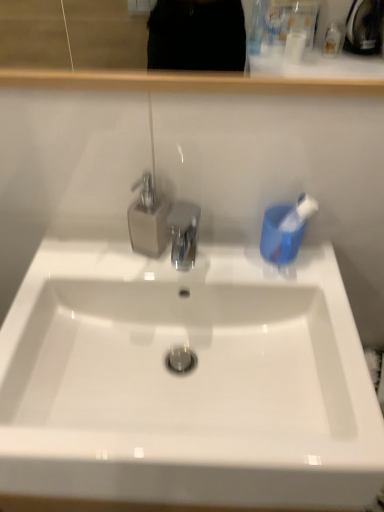
What is the approximate height of blue plastic toothbrush at right?

blue plastic toothbrush at right is 3.92 inches in height.

Locate an element on the screen. blue plastic toothbrush at right is located at coordinates (292, 230).

I want to click on transparent plastic tap at center, so click(x=148, y=219).

The height and width of the screenshot is (512, 384). What do you see at coordinates (186, 381) in the screenshot?
I see `white glossy sink at center` at bounding box center [186, 381].

Identify the location of blue plastic toothbrush at right. (292, 230).

Is transparent plastic tap at center taller than white glossy sink at center?

Correct, transparent plastic tap at center is much taller as white glossy sink at center.

From the image's perspective, is transparent plastic tap at center located beneath white glossy sink at center?

No, from the image's perspective, transparent plastic tap at center is not beneath white glossy sink at center.

Could you tell me if transparent plastic tap at center is turned towards white glossy sink at center?

Yes.

Considering the positions of objects transparent plastic tap at center and white glossy sink at center in the image provided, who is behind, transparent plastic tap at center or white glossy sink at center?

transparent plastic tap at center is more distant.

Considering the positions of objects blue plastic toothbrush at right and white glossy sink at center in the image provided, who is more to the right, blue plastic toothbrush at right or white glossy sink at center?

Positioned to the right is blue plastic toothbrush at right.

How many degrees apart are the facing directions of blue plastic toothbrush at right and white glossy sink at center?

blue plastic toothbrush at right and white glossy sink at center are facing 2.15 degrees away from each other.

Identify the location of sink lying in front of the blue plastic toothbrush at right. (186, 381).

From a real-world perspective, does blue plastic toothbrush at right stand above white glossy sink at center?

Yes, from a real-world perspective, blue plastic toothbrush at right is over white glossy sink at center

Which of these two, blue plastic toothbrush at right or transparent plastic tap at center, stands shorter?

blue plastic toothbrush at right.

Would you consider blue plastic toothbrush at right to be distant from transparent plastic tap at center?

No, blue plastic toothbrush at right is in close proximity to transparent plastic tap at center.

Who is smaller, blue plastic toothbrush at right or transparent plastic tap at center?

blue plastic toothbrush at right.

From the image's perspective, is blue plastic toothbrush at right located above transparent plastic tap at center?

No, from the image's perspective, blue plastic toothbrush at right is not over transparent plastic tap at center.

Considering the sizes of objects white glossy sink at center and blue plastic toothbrush at right in the image provided, who is bigger, white glossy sink at center or blue plastic toothbrush at right?

white glossy sink at center.

Is the surface of white glossy sink at center in direct contact with blue plastic toothbrush at right?

No, white glossy sink at center is not touching blue plastic toothbrush at right.

Is white glossy sink at center to the right of blue plastic toothbrush at right from the viewer's perspective?

Incorrect, white glossy sink at center is not on the right side of blue plastic toothbrush at right.

Which object is positioned more to the left, transparent plastic tap at center or blue plastic toothbrush at right?

transparent plastic tap at center.

How much distance is there between transparent plastic tap at center and blue plastic toothbrush at right?

They are 9.42 inches apart.

Which object is wider, transparent plastic tap at center or blue plastic toothbrush at right?

Wider between the two is transparent plastic tap at center.

From the picture: Can you tell me how much transparent plastic tap at center and blue plastic toothbrush at right differ in facing direction?

There is a 2.15-degree angle between the facing directions of transparent plastic tap at center and blue plastic toothbrush at right.

The width and height of the screenshot is (384, 512). What are the coordinates of `sink in front of the transparent plastic tap at center` in the screenshot? It's located at (186, 381).

Which is less distant, [245,319] or [140,205]?

Point [245,319] is positioned farther from the camera compared to point [140,205].

Consider the image. Is transparent plastic tap at center at the back of white glossy sink at center?

That's not correct — white glossy sink at center is not looking away from transparent plastic tap at center.

Which object is positioned more to the right, white glossy sink at center or transparent plastic tap at center?

From the viewer's perspective, white glossy sink at center appears more on the right side.

In the image, there is a white glossy sink at center. Where is `tap above it (from the image's perspective)`? The image size is (384, 512). tap above it (from the image's perspective) is located at coordinates (148, 219).

In the image, there is a blue plastic toothbrush at right. At what (x,y) coordinates should I click in order to perform the action: click on sink below it (from the image's perspective). Please return your answer as a coordinate pair (x, y). The width and height of the screenshot is (384, 512). Looking at the image, I should click on (186, 381).

Estimate the real-world distances between objects in this image. Which object is closer to transparent plastic tap at center, white glossy sink at center or blue plastic toothbrush at right?

blue plastic toothbrush at right is closer to transparent plastic tap at center.

Looking at the image, which one is located further to blue plastic toothbrush at right, transparent plastic tap at center or white glossy sink at center?

Among the two, white glossy sink at center is located further to blue plastic toothbrush at right.

Based on their spatial positions, is blue plastic toothbrush at right or transparent plastic tap at center further from white glossy sink at center?

Among the two, blue plastic toothbrush at right is located further to white glossy sink at center.

When comparing their distances from transparent plastic tap at center, does blue plastic toothbrush at right or white glossy sink at center seem closer?

Based on the image, blue plastic toothbrush at right appears to be nearer to transparent plastic tap at center.

Based on their spatial positions, is white glossy sink at center or transparent plastic tap at center closer to blue plastic toothbrush at right?

transparent plastic tap at center is positioned closer to the anchor blue plastic toothbrush at right.

In the scene shown: Looking at the image, which one is located closer to white glossy sink at center, transparent plastic tap at center or blue plastic toothbrush at right?

transparent plastic tap at center.

Find the location of a particular element. sink between transparent plastic tap at center and blue plastic toothbrush at right in the horizontal direction is located at coordinates (186, 381).